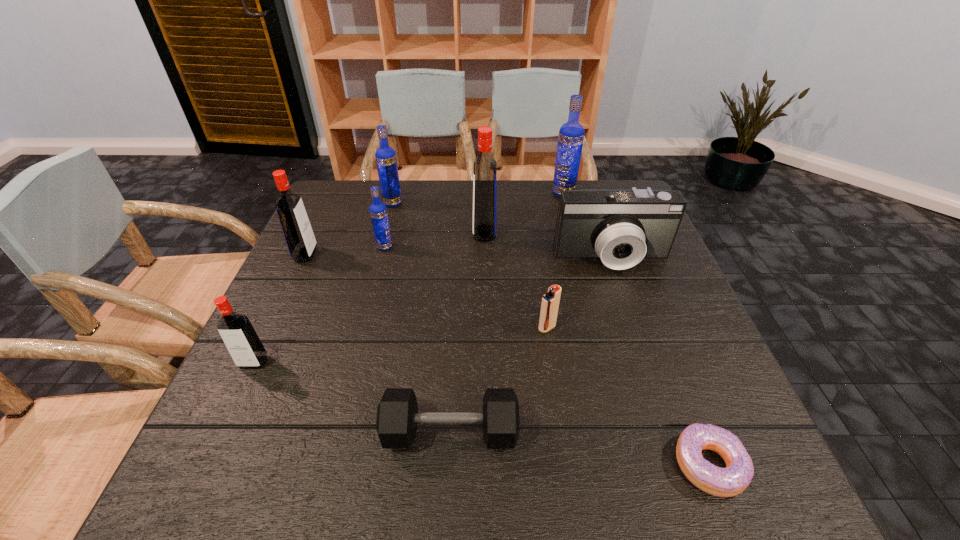
Image resolution: width=960 pixels, height=540 pixels. Find the location of `the fourth nearest object`. the fourth nearest object is located at coordinates (550, 301).

Where is `the third shortest object`? This screenshot has width=960, height=540. the third shortest object is located at coordinates (550, 301).

Find the location of a particular element. Image resolution: width=960 pixels, height=540 pixels. dumbbell is located at coordinates (397, 413).

The image size is (960, 540). What are the coordinates of `purple doughnut` in the screenshot? It's located at (723, 482).

Locate an element on the screen. the shortest object is located at coordinates (723, 482).

You are a GUI agent. You are given a task and a screenshot of the screen. Output one action in this format:
    pyautogui.click(x=<x>, y=<y>)
    Task: Click on the vacant area located on the front of the rightmost blue vodka
    
    Given the screenshot: What is the action you would take?
    pyautogui.click(x=587, y=280)

Where is `vacant space located 0.400m on the front and back of the fifth vodka from left to right`? Image resolution: width=960 pixels, height=540 pixels. vacant space located 0.400m on the front and back of the fifth vodka from left to right is located at coordinates (329, 233).

I want to click on vacant space positioned on the front and back of the fifth vodka from left to right, so click(x=416, y=233).

Locate an element on the screen. The width and height of the screenshot is (960, 540). vacant space located on the front and back of the fifth vodka from left to right is located at coordinates (387, 233).

Image resolution: width=960 pixels, height=540 pixels. I want to click on vacant region located on the front of the second smallest blue vodka, so click(384, 234).